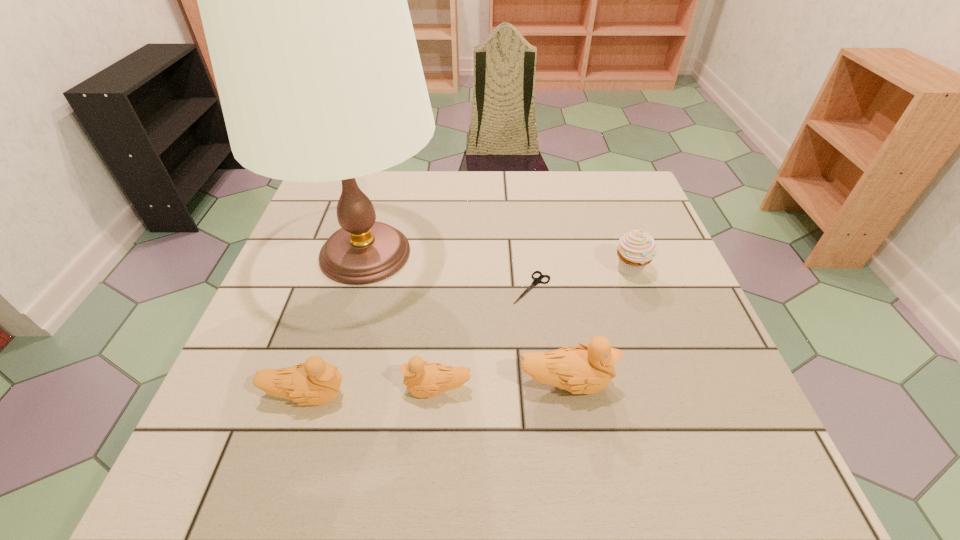
Locate an element on the screen. This screenshot has width=960, height=540. free space between the shortest duckling and the tallest object is located at coordinates (401, 322).

Find the location of a particular element. Image resolution: width=960 pixels, height=540 pixels. free space between the tallest object and the shears is located at coordinates (448, 271).

Locate an element on the screen. empty location between the rightmost duckling and the shears is located at coordinates (548, 335).

Locate an element on the screen. free space between the lamp and the second shortest object is located at coordinates (401, 322).

Find the location of `free spot between the shortest duckling and the rightmost duckling`. free spot between the shortest duckling and the rightmost duckling is located at coordinates (501, 387).

At what (x,y) coordinates should I click in order to perform the action: click on vacant area that lies between the rightmost duckling and the muffin. Please return your answer as a coordinate pair (x, y). The height and width of the screenshot is (540, 960). Looking at the image, I should click on (598, 327).

Locate an element on the screen. The width and height of the screenshot is (960, 540). vacant area that lies between the rightmost duckling and the rightmost object is located at coordinates (598, 327).

Where is `vacant point located between the shears and the second tallest duckling`? This screenshot has width=960, height=540. vacant point located between the shears and the second tallest duckling is located at coordinates (420, 342).

The image size is (960, 540). Identify the location of vacant space that's between the shortest object and the rightmost duckling. (548, 335).

Point out which object is positioned as the fourth nearest to the tallest object. Please provide its 2D coordinates. Your answer should be formatted as a tuple, i.e. [(x, y)], where the tuple contains the x and y coordinates of a point satisfying the conditions above.

[(588, 369)]